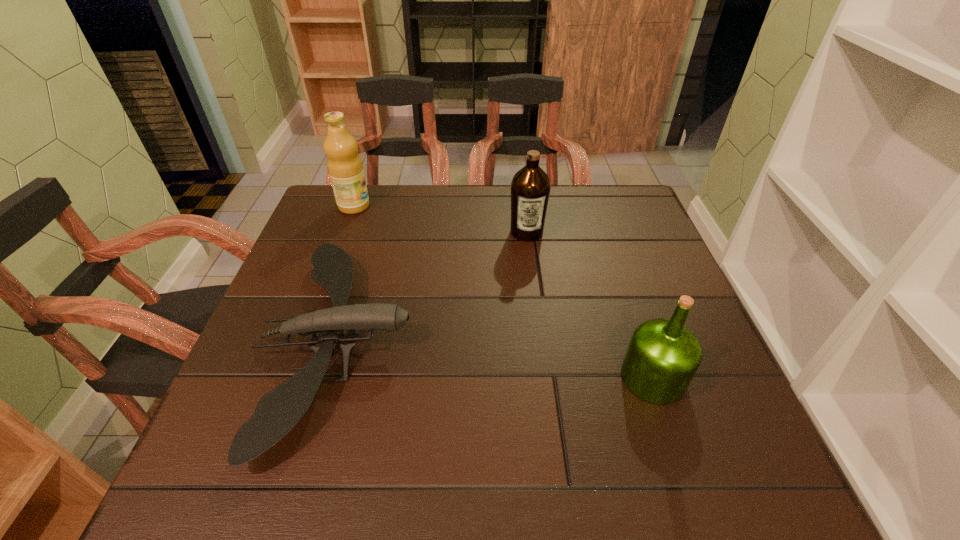
At what (x,y) coordinates should I click in order to perform the action: click on vacant point located between the nearest olive oil and the second farthest olive oil. Please return your answer as a coordinate pair (x, y). This screenshot has width=960, height=540. Looking at the image, I should click on (589, 305).

Select which object is the second closest to the nearest olive oil. Please provide its 2D coordinates. Your answer should be formatted as a tuple, i.e. [(x, y)], where the tuple contains the x and y coordinates of a point satisfying the conditions above.

[(277, 412)]

Locate an element on the screen. This screenshot has width=960, height=540. object that is the third closest to the rightmost object is located at coordinates (345, 168).

Where is `olive oil identified as the second closest to the drone`? olive oil identified as the second closest to the drone is located at coordinates (530, 188).

The image size is (960, 540). I want to click on olive oil that stands as the second closest to the rightmost olive oil, so click(x=345, y=168).

This screenshot has width=960, height=540. Find the location of `vacant space that satisfies the following two spatial constraints: 1. at the head of the rightmost object; 2. on the left side of the drone`. vacant space that satisfies the following two spatial constraints: 1. at the head of the rightmost object; 2. on the left side of the drone is located at coordinates (327, 377).

At what (x,y) coordinates should I click in order to perform the action: click on free location that satisfies the following two spatial constraints: 1. on the label of the farthest olive oil; 2. on the back side of the rightmost object. Please return your answer as a coordinate pair (x, y). Looking at the image, I should click on (291, 377).

The width and height of the screenshot is (960, 540). Find the location of `free location that satisfies the following two spatial constraints: 1. on the label of the rightmost object; 2. on the right side of the farthest object`. free location that satisfies the following two spatial constraints: 1. on the label of the rightmost object; 2. on the right side of the farthest object is located at coordinates (291, 377).

At what (x,y) coordinates should I click in order to perform the action: click on free spot that satisfies the following two spatial constraints: 1. at the head of the rightmost object; 2. on the right side of the drone. Please return your answer as a coordinate pair (x, y). The image size is (960, 540). Looking at the image, I should click on (327, 377).

The image size is (960, 540). I want to click on blank space that satisfies the following two spatial constraints: 1. on the label of the leftmost olive oil; 2. on the left side of the rightmost object, so coord(291,377).